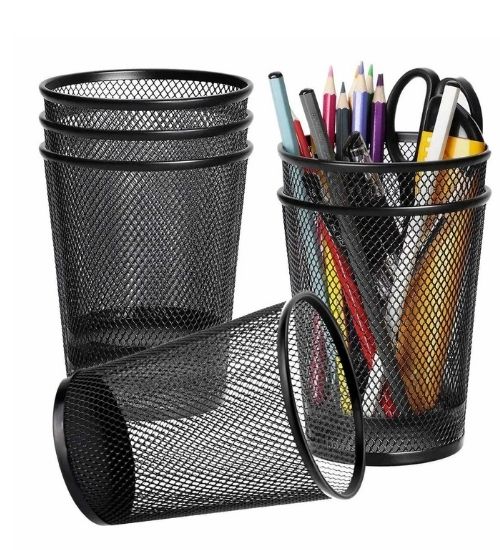
Image resolution: width=500 pixels, height=550 pixels. In order to click on left most four cups in this screenshot , I will do `click(146, 108)`, `click(144, 132)`, `click(141, 162)`, `click(208, 373)`.